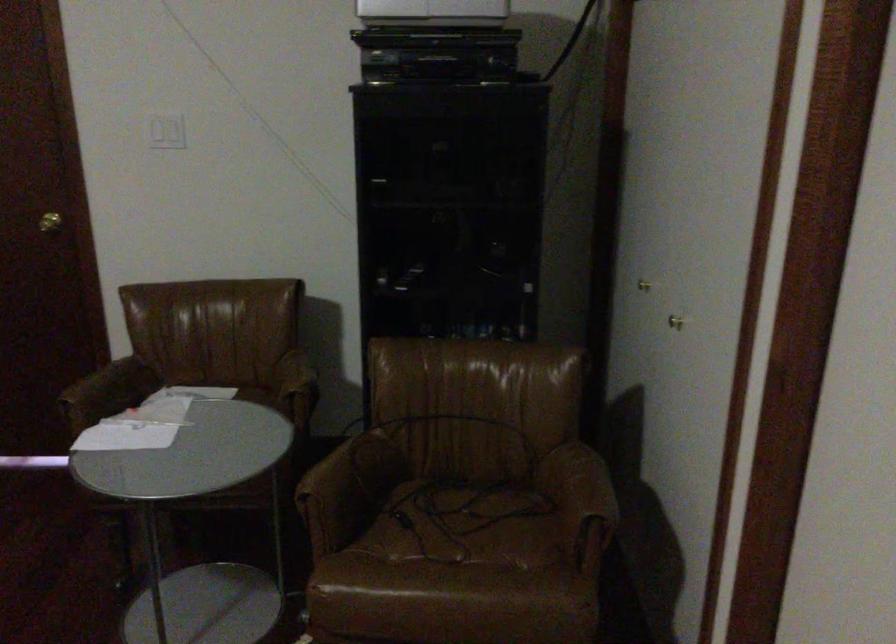
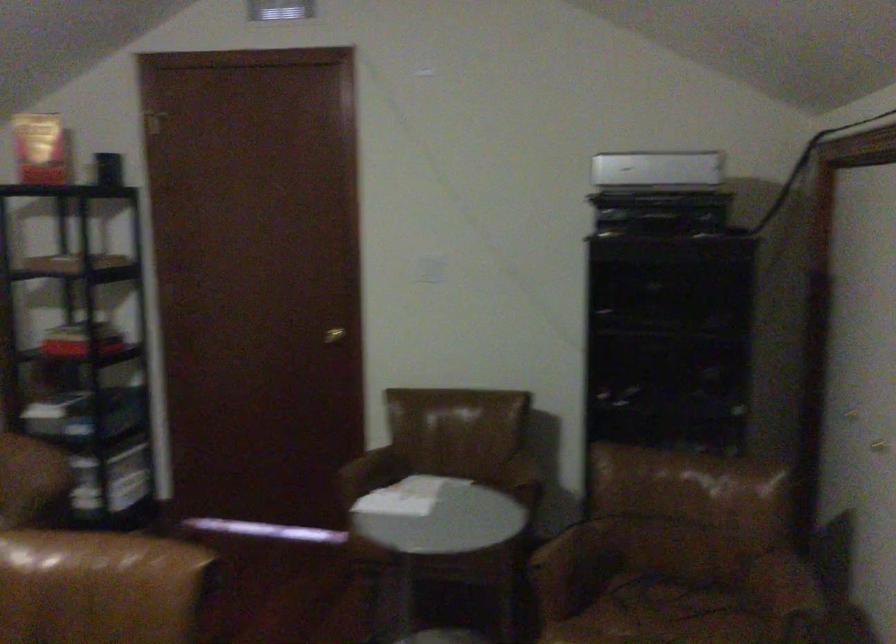
Question: Which direction would the cameraman need to move to produce the second image? Reply with the corresponding letter.

Choices:
 (A) Left
 (B) Right
 (C) Forward
 (D) Backward

Answer: (D)